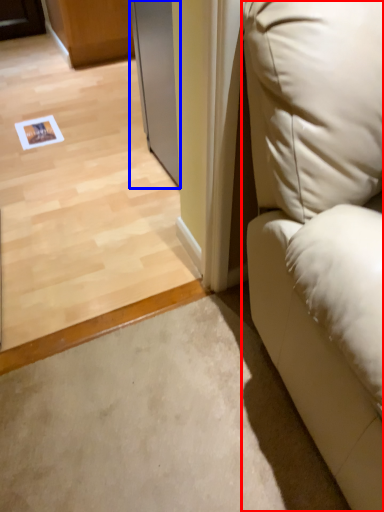
Question: Which object is further to the camera taking this photo, furniture (highlighted by a red box) or screen door (highlighted by a blue box)?

Choices:
 (A) furniture
 (B) screen door

Answer: (B)